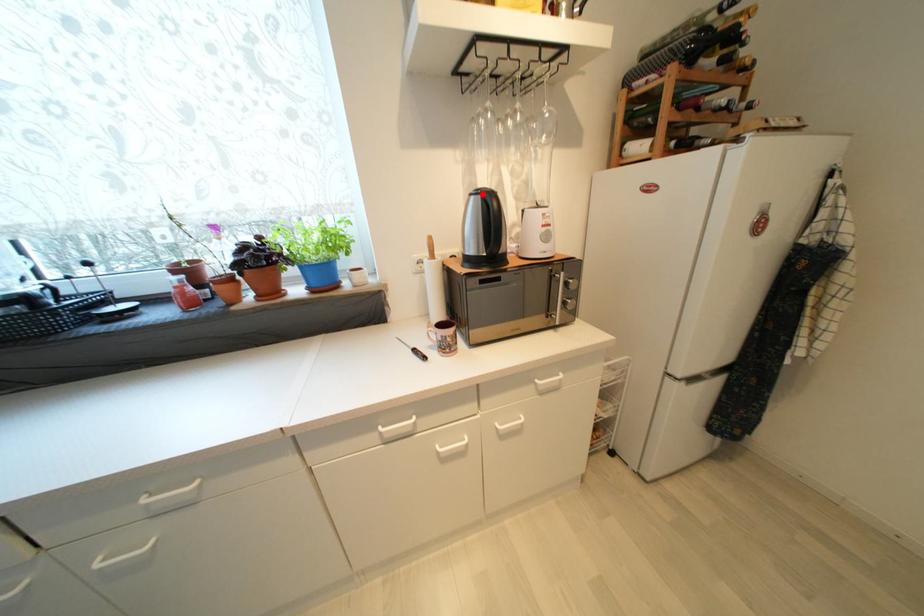
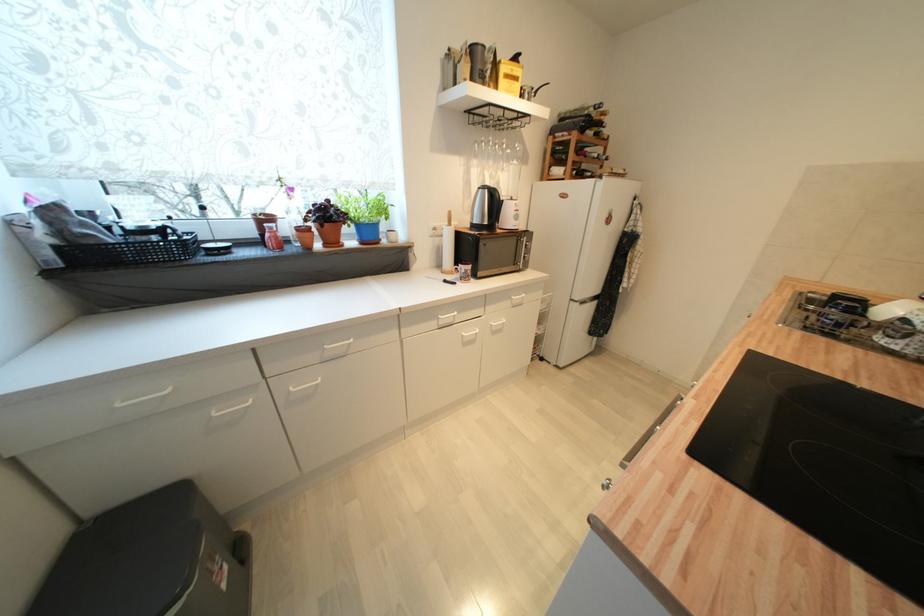
Find the pixel in the second image that matches the highlighted location in the first image.

(489, 188)